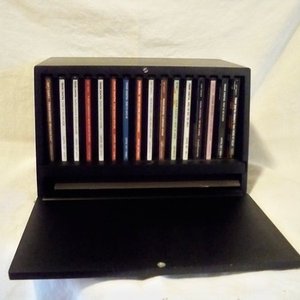
This screenshot has height=300, width=300. Identify the location of cds. (77, 113), (88, 113).